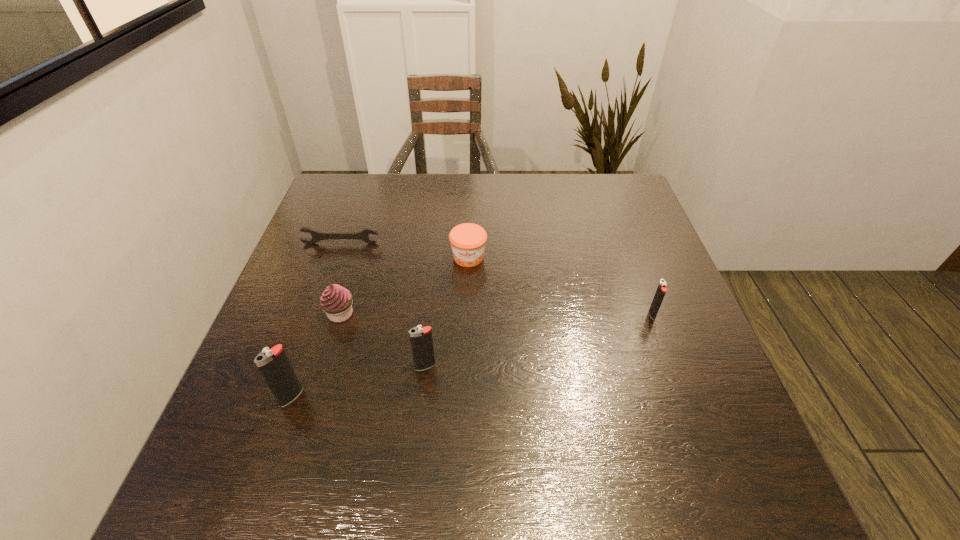
Please point a location where one more igniter can be added evenly. Please provide its 2D coordinates. Your answer should be formatted as a tuple, i.e. [(x, y)], where the tuple contains the x and y coordinates of a point satisfying the conditions above.

[(544, 339)]